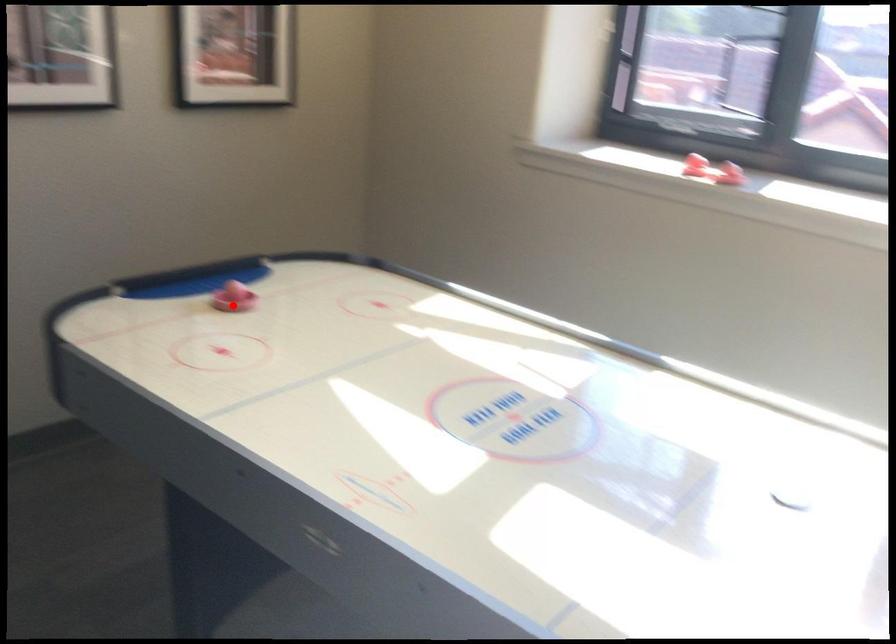
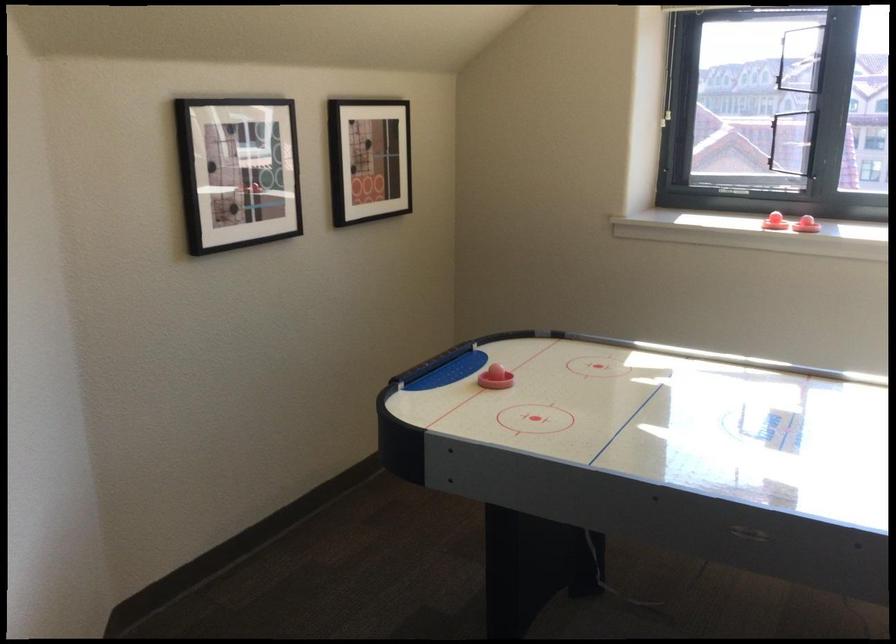
The point at the highlighted location is marked in the first image. Where is the corresponding point in the second image?

(495, 379)